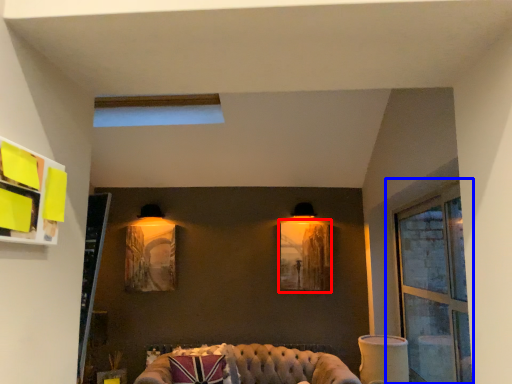
Question: Among these objects, which one is nearest to the camera, picture frame (highlighted by a red box) or window (highlighted by a blue box)?

Choices:
 (A) picture frame
 (B) window

Answer: (B)